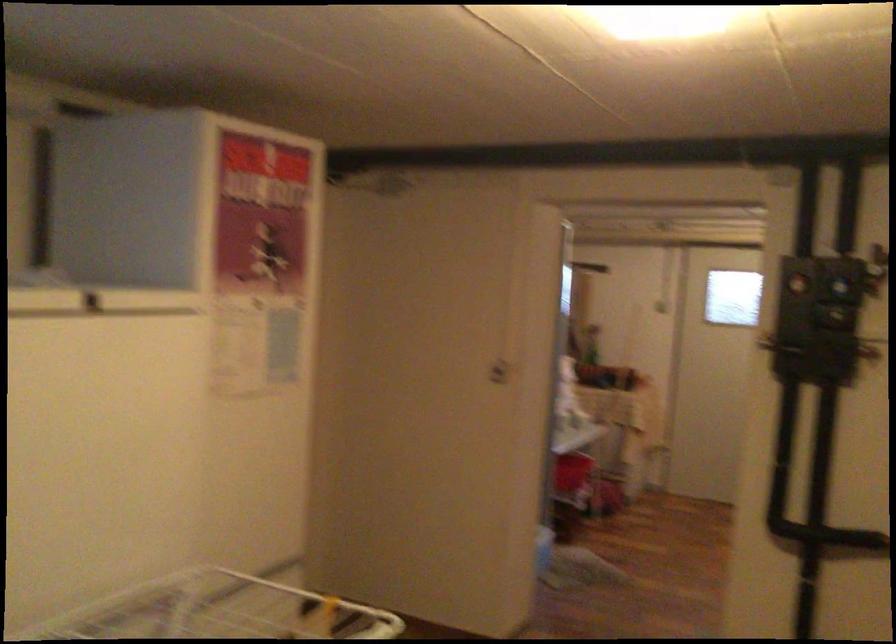
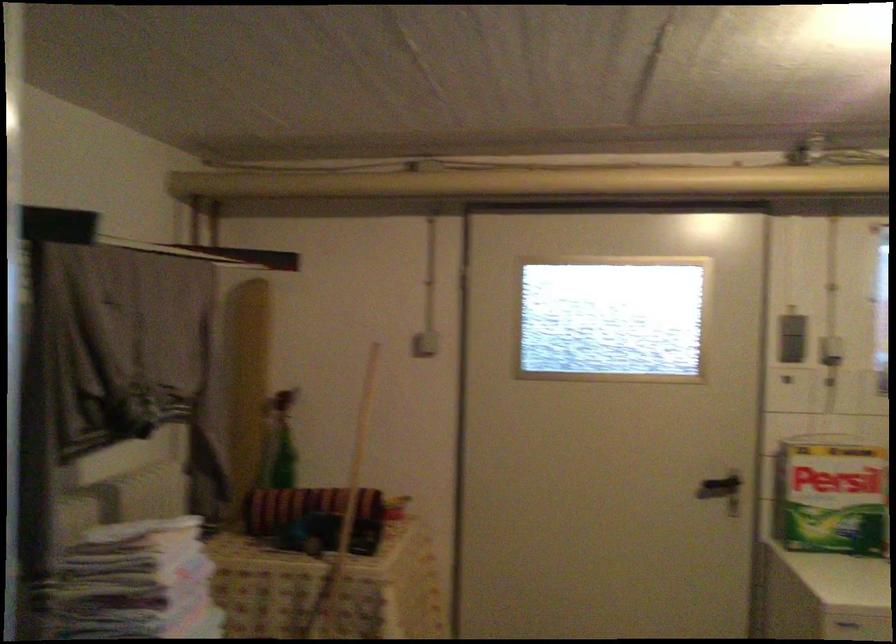
Question: What movement of the cameraman would produce the second image?

Choices:
 (A) Left
 (B) Right
 (C) Forward
 (D) Backward

Answer: (C)